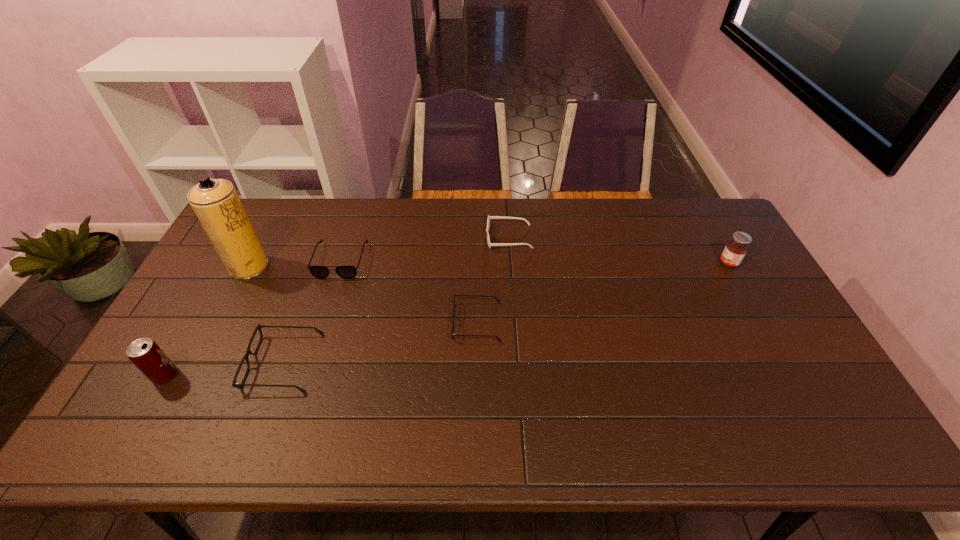
Please point a spot to add another spectacles on the right. Please provide its 2D coordinates. Your answer should be formatted as a tuple, i.e. [(x, y)], where the tuple contains the x and y coordinates of a point satisfying the conditions above.

[(642, 286)]